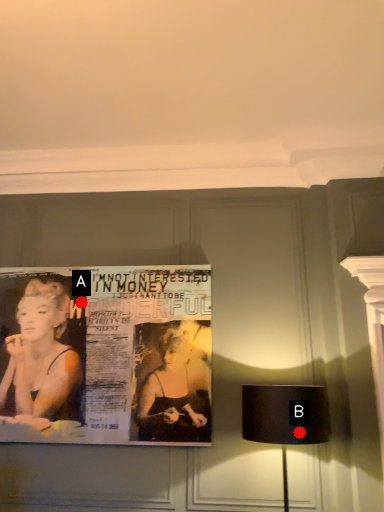
Question: Two points are circled on the image, labeled by A and B beside each circle. Which point is closer to the camera?

Choices:
 (A) A is closer
 (B) B is closer

Answer: (B)